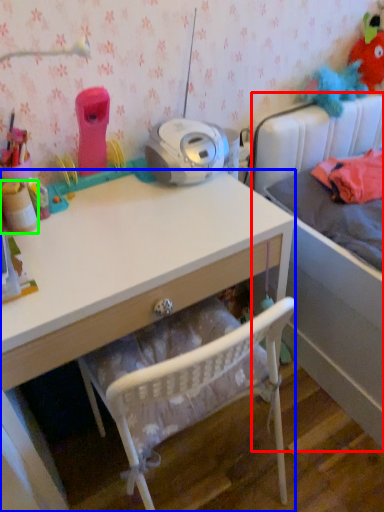
Question: Which is nearer to the bed (highlighted by a red box)? desk (highlighted by a blue box) or toy (highlighted by a green box).

Choices:
 (A) desk
 (B) toy

Answer: (A)